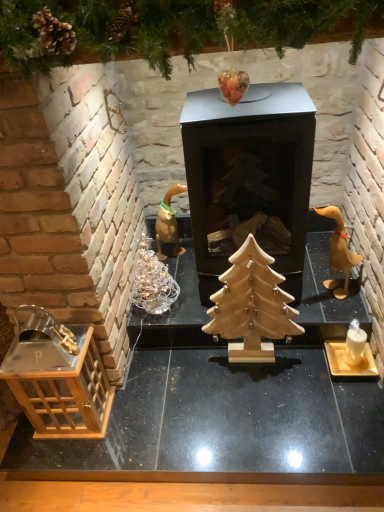
Identify the location of vacant space in wooden christmas tree at upper center (from a real-world perspective). The width and height of the screenshot is (384, 512). (213, 390).